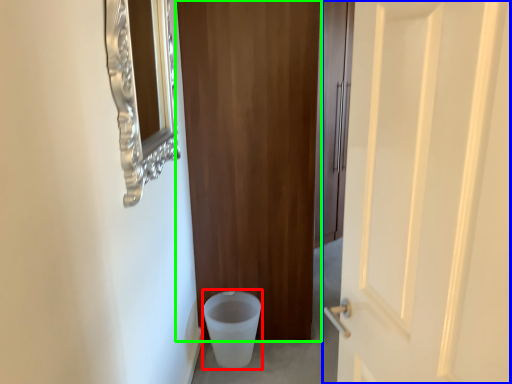
Question: Which is nearer to the potty (highlighted by a red box)? door (highlighted by a blue box) or door (highlighted by a green box).

Choices:
 (A) door
 (B) door

Answer: (B)